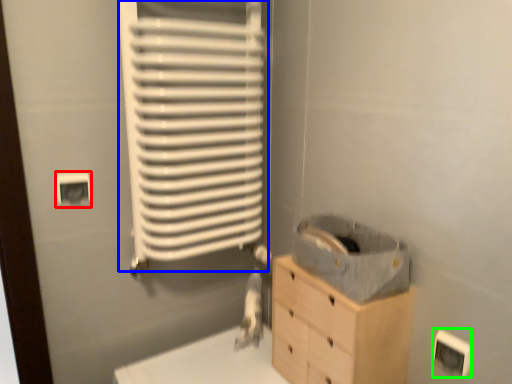
Question: Considering the real-world distances, which object is closest to electric outlet (highlighted by a red box)? radiator (highlighted by a blue box) or electric outlet (highlighted by a green box).

Choices:
 (A) radiator
 (B) electric outlet

Answer: (A)